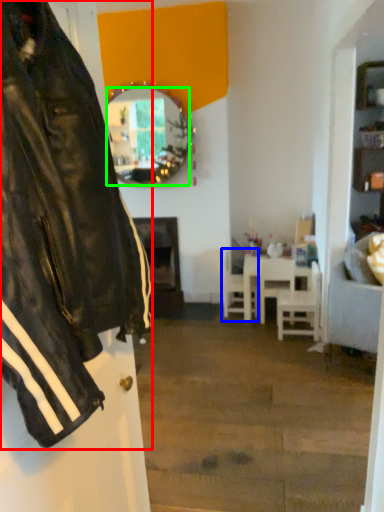
Question: Based on their relative distances, which object is farther from jacket (highlighted by a red box)? Choose from chair (highlighted by a blue box) and mirror (highlighted by a green box).

Choices:
 (A) chair
 (B) mirror

Answer: (A)